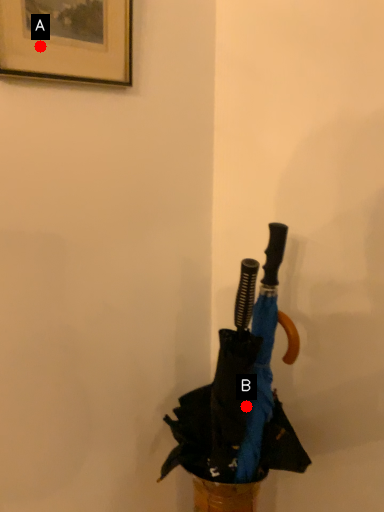
Question: Two points are circled on the image, labeled by A and B beside each circle. Which point appears closest to the camera in this image?

Choices:
 (A) A is closer
 (B) B is closer

Answer: (A)